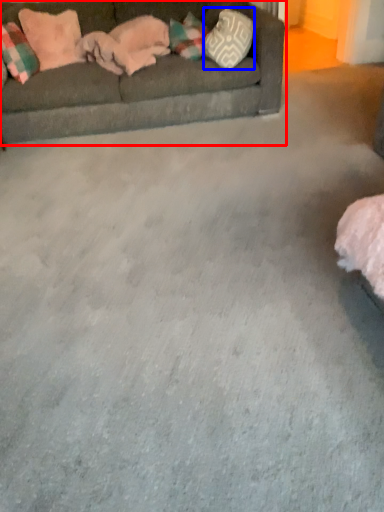
Question: Which of the following is the closest to the observer, studio couch (highlighted by a red box) or pillow (highlighted by a blue box)?

Choices:
 (A) studio couch
 (B) pillow

Answer: (A)